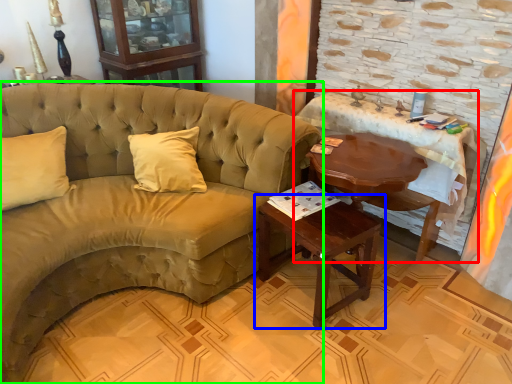
Question: Estimate the real-world distances between objects in this image. Which object is closer to table (highlighted by a red box), table (highlighted by a blue box) or studio couch (highlighted by a green box)?

Choices:
 (A) table
 (B) studio couch

Answer: (A)